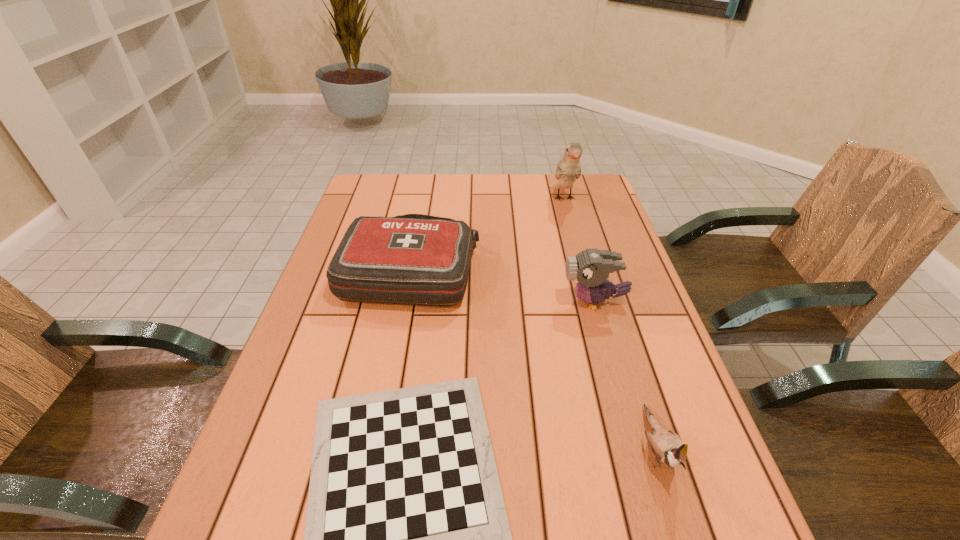
Find the location of a particular element. The width and height of the screenshot is (960, 540). vacant space in between the shortest bird and the tallest bird is located at coordinates (611, 323).

You are a GUI agent. You are given a task and a screenshot of the screen. Output one action in this format:
    pyautogui.click(x=<x>, y=<y>)
    Task: Click on the unoccupied position between the second tallest object and the shortest bird
    The width and height of the screenshot is (960, 540).
    Given the screenshot: What is the action you would take?
    pyautogui.click(x=625, y=374)

Where is `vacant area between the first-aid kit and the nearest bird`? The image size is (960, 540). vacant area between the first-aid kit and the nearest bird is located at coordinates (534, 358).

Image resolution: width=960 pixels, height=540 pixels. I want to click on object that is the fourth closest to the nearest bird, so click(568, 169).

Locate an element on the screen. Image resolution: width=960 pixels, height=540 pixels. the third closest object to the nearest bird is located at coordinates (414, 259).

This screenshot has width=960, height=540. In order to click on bird that is the closest to the farthest object in this screenshot , I will do coord(591,267).

Locate an element on the screen. The height and width of the screenshot is (540, 960). the second closest bird to the shortest object is located at coordinates (591, 267).